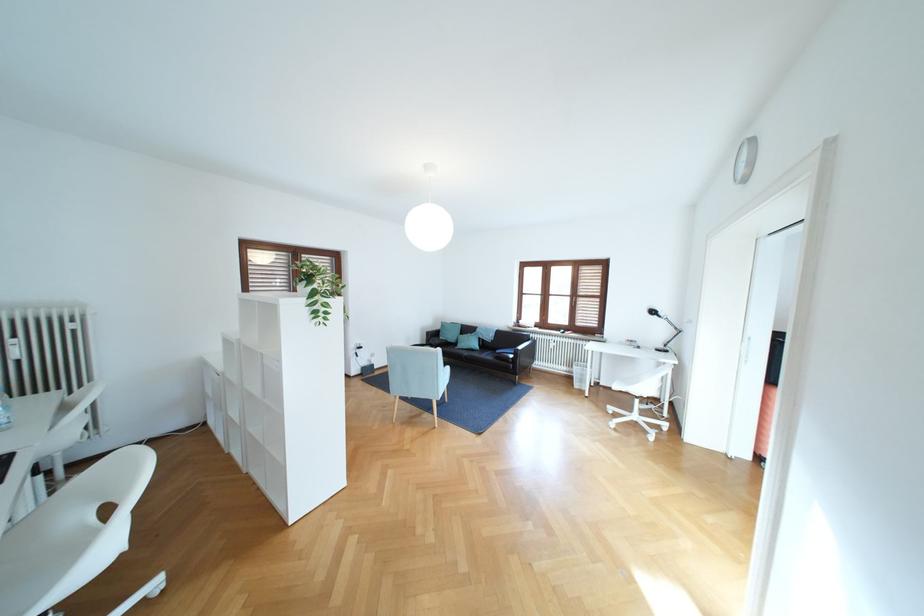
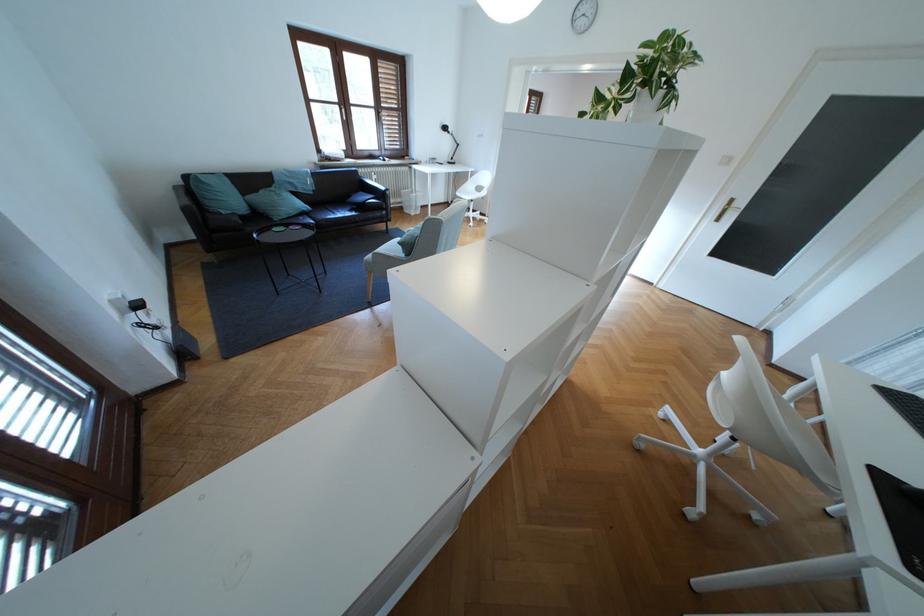
The point at [451,339] is marked in the first image. Where is the corresponding point in the second image?

(234, 213)